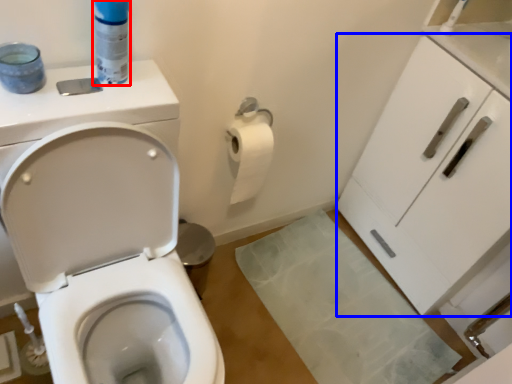
Question: Which object is further to the camera taking this photo, cleaning product (highlighted by a red box) or cabinetry (highlighted by a blue box)?

Choices:
 (A) cleaning product
 (B) cabinetry

Answer: (B)